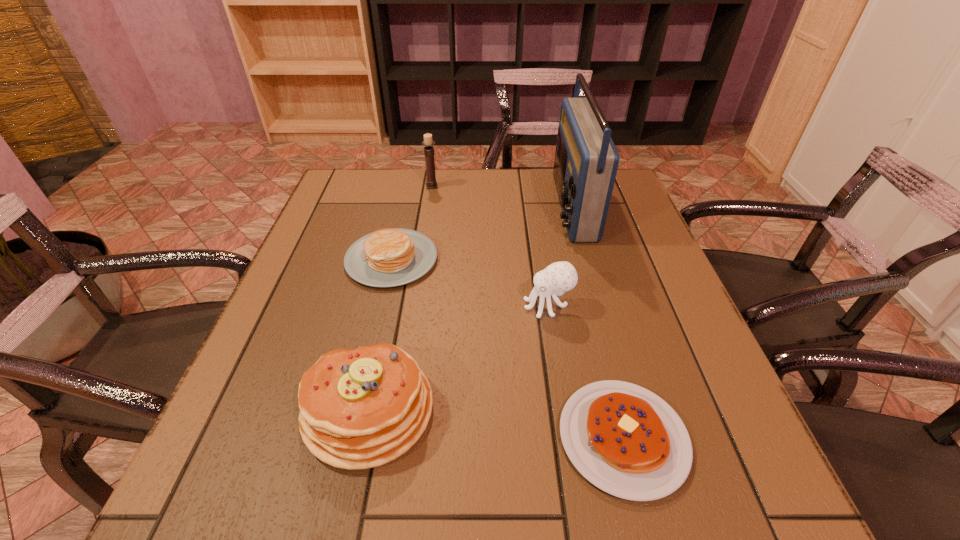
Locate an element on the screen. The image size is (960, 540). vacant space at the near right corner of the desktop is located at coordinates (699, 485).

Locate an element on the screen. The height and width of the screenshot is (540, 960). vacant space in between the radio receiver and the octopus is located at coordinates (560, 256).

Identify the location of vacant space in between the farthest pancake and the shortest object. The width and height of the screenshot is (960, 540). (507, 348).

Where is `vacant space that's between the tallest pancake and the fourth farthest object`? Image resolution: width=960 pixels, height=540 pixels. vacant space that's between the tallest pancake and the fourth farthest object is located at coordinates (458, 357).

Find the location of a particular element. vacant space in between the tallest object and the second tallest pancake is located at coordinates (482, 233).

Identify the location of vacant area that lies between the second tallest pancake and the fourth farthest object. pyautogui.click(x=469, y=282).

The width and height of the screenshot is (960, 540). I want to click on unoccupied area between the fifth tallest object and the second tallest object, so click(x=412, y=222).

At what (x,y) coordinates should I click in order to perform the action: click on blank region between the fifth shortest object and the octopus. Please return your answer as a coordinate pair (x, y). Looking at the image, I should click on (490, 246).

You are a GUI agent. You are given a task and a screenshot of the screen. Output one action in this format:
    pyautogui.click(x=<x>, y=<y>)
    Task: Click on the empty location between the octopus and the tallest pancake
    
    Given the screenshot: What is the action you would take?
    [x=458, y=357]

Find the location of a particular element. free spot between the fifth shortest object and the rightmost pancake is located at coordinates (527, 312).